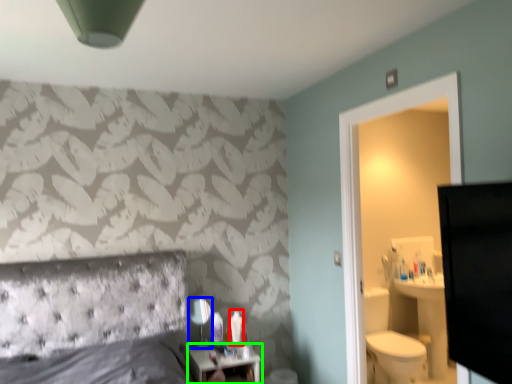
Question: Which object is the farthest from toiletry (highlighted by a red box)? Choose among these: mirror (highlighted by a blue box) or nightstand (highlighted by a green box).

Choices:
 (A) mirror
 (B) nightstand

Answer: (A)